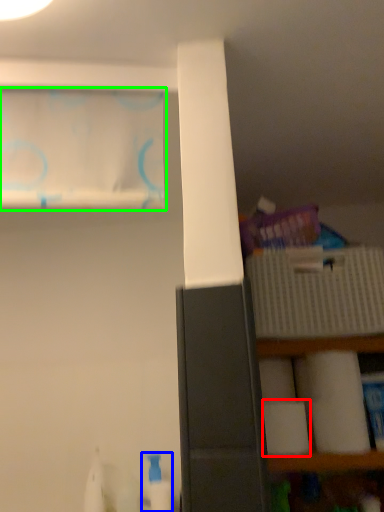
Question: Which is nearer to the toilet paper (highlighted by a red box)? cleaning product (highlighted by a blue box) or curtain (highlighted by a green box).

Choices:
 (A) cleaning product
 (B) curtain

Answer: (A)